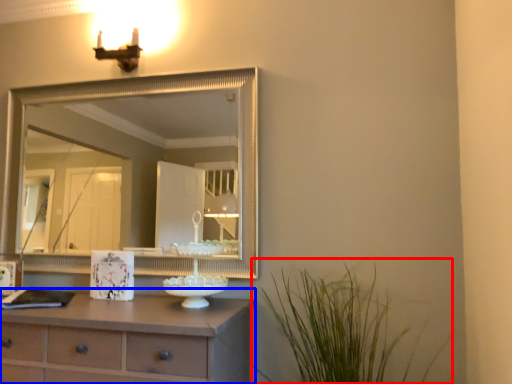
Question: Which point is further to the camera, plant (highlighted by a red box) or chest of drawers (highlighted by a blue box)?

Choices:
 (A) plant
 (B) chest of drawers

Answer: (B)